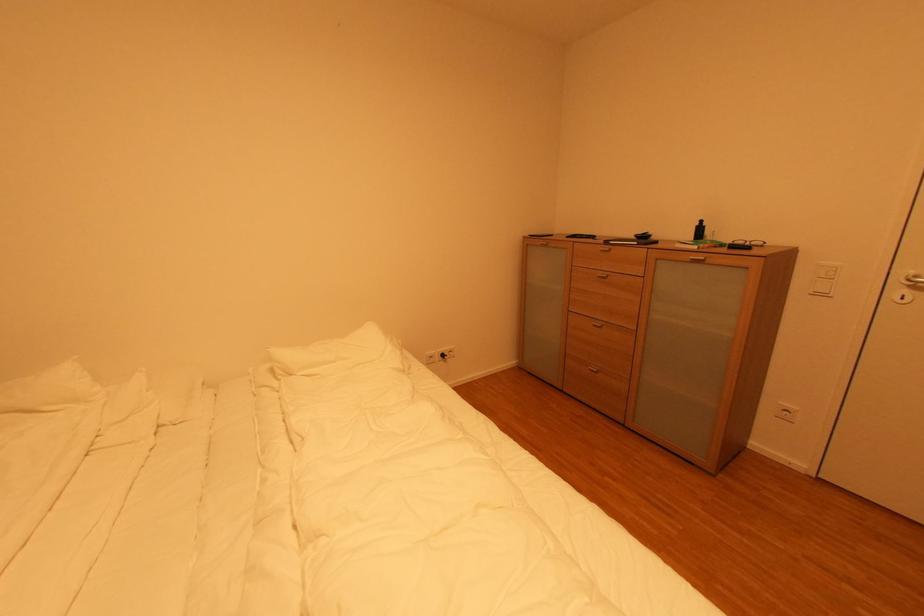
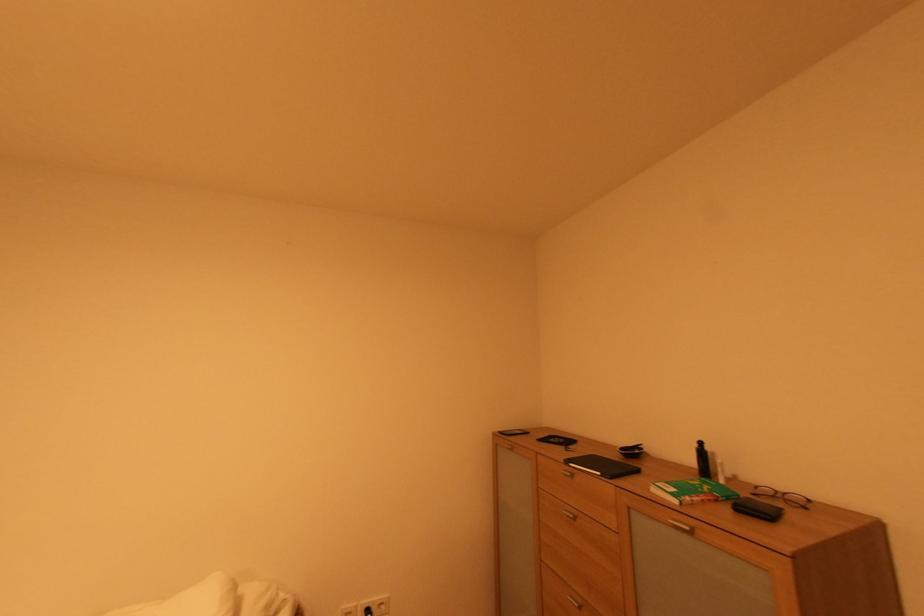
Locate, in the second image, the point that corresponds to pixel 700 248 in the first image.

(682, 503)